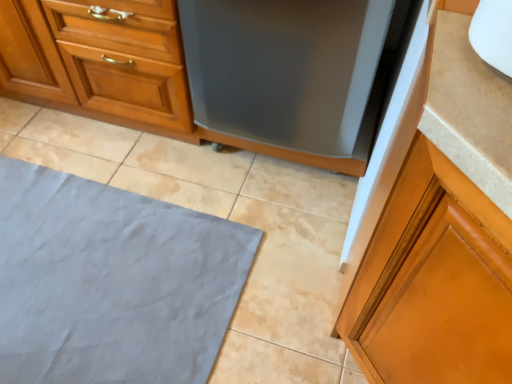
You are a GUI agent. You are given a task and a screenshot of the screen. Output one action in this format:
    pyautogui.click(x=<x>, y=<y>)
    Task: Click on the vacant area on top of gray fabric bath mat at lower left (from a real-world perspective)
    Image resolution: width=512 pixels, height=384 pixels.
    Given the screenshot: What is the action you would take?
    pyautogui.click(x=91, y=269)